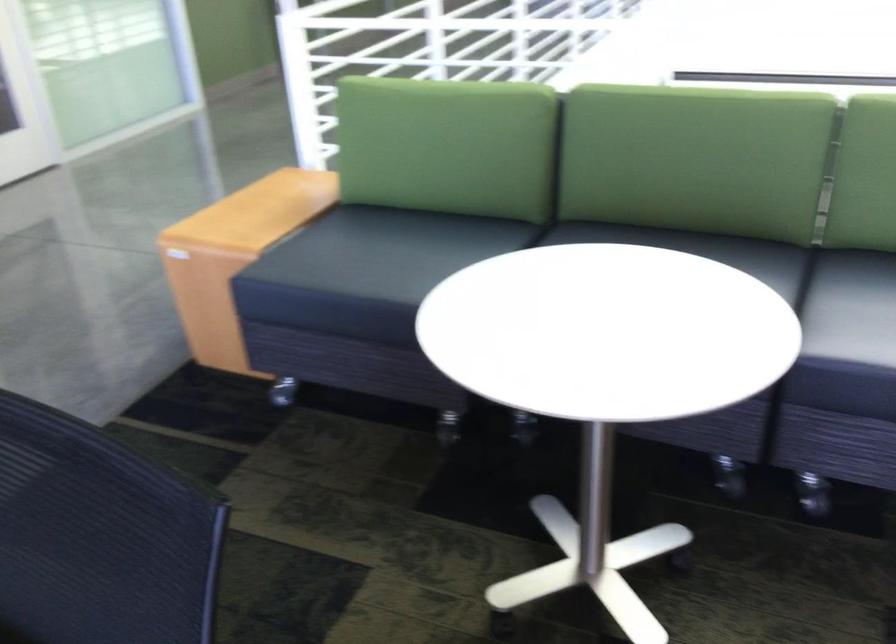
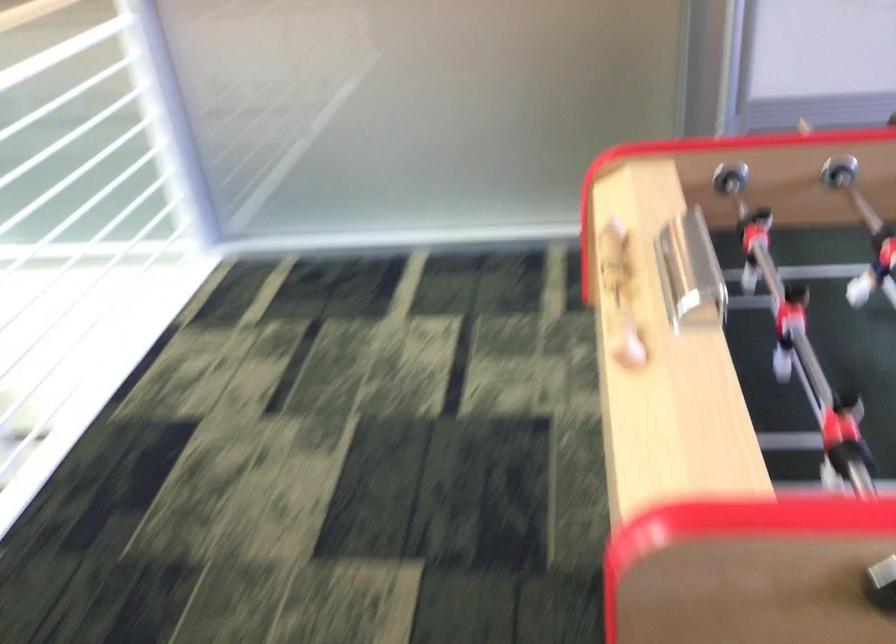
First-person continuous shooting, in which direction is the camera rotating?

The camera's rotation is toward right-down.